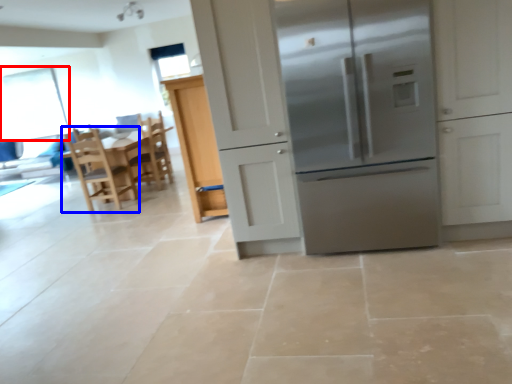
Question: Which object is closer to the camera taking this photo, window screen (highlighted by a red box) or chair (highlighted by a blue box)?

Choices:
 (A) window screen
 (B) chair

Answer: (B)